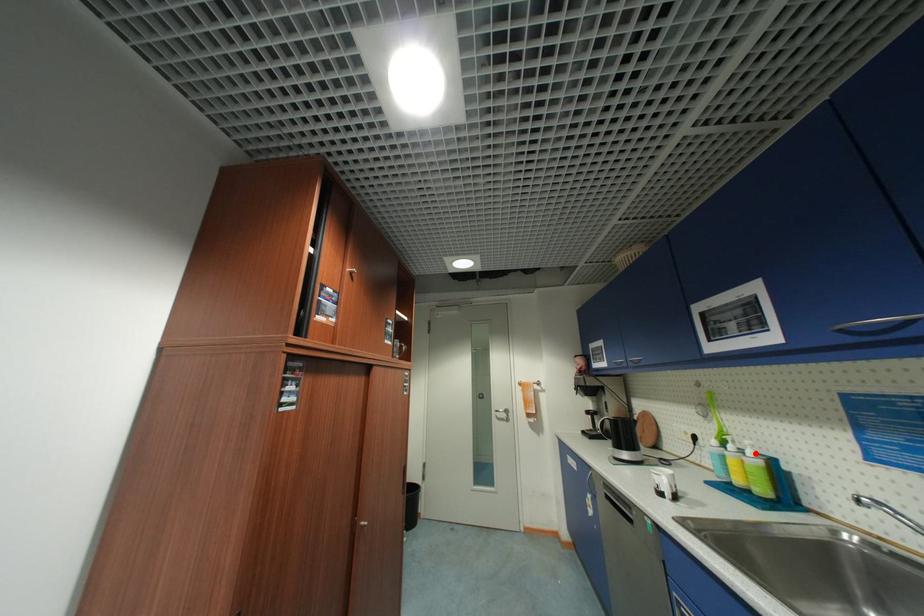
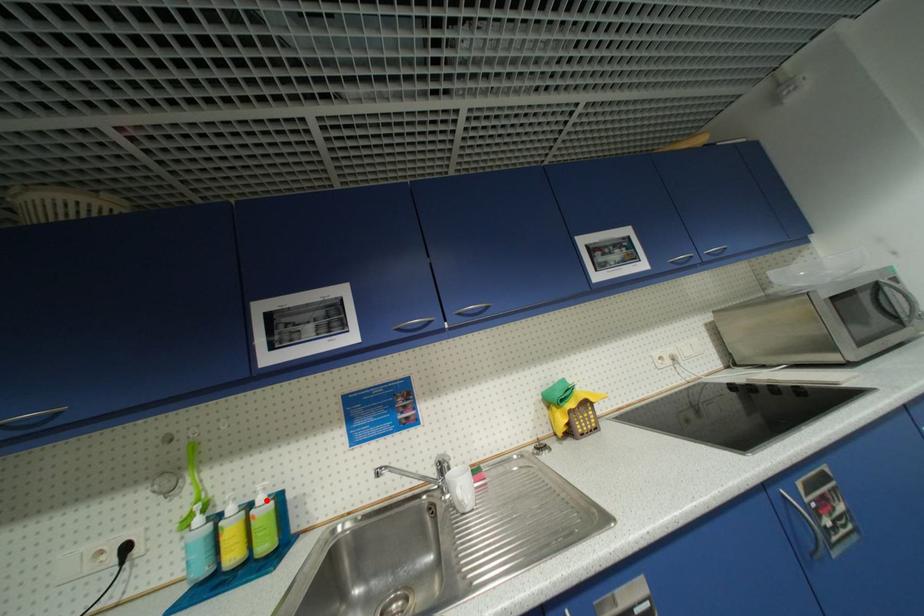
I am providing you with two images of the same scene from different viewpoints. A red point is marked on the first image and another point is marked on the second image. Are the points marked in image1 and image2 representing the same 3D position?

Yes